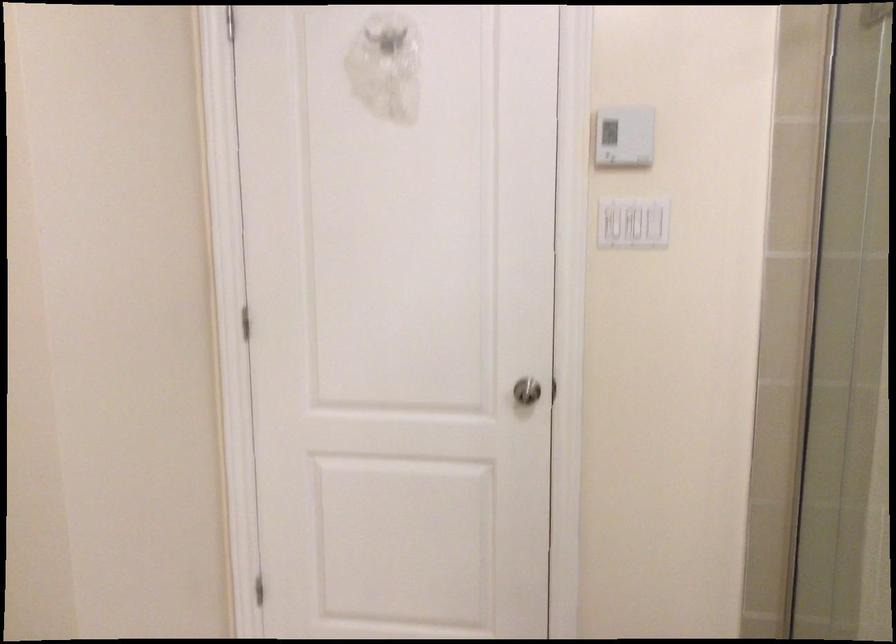
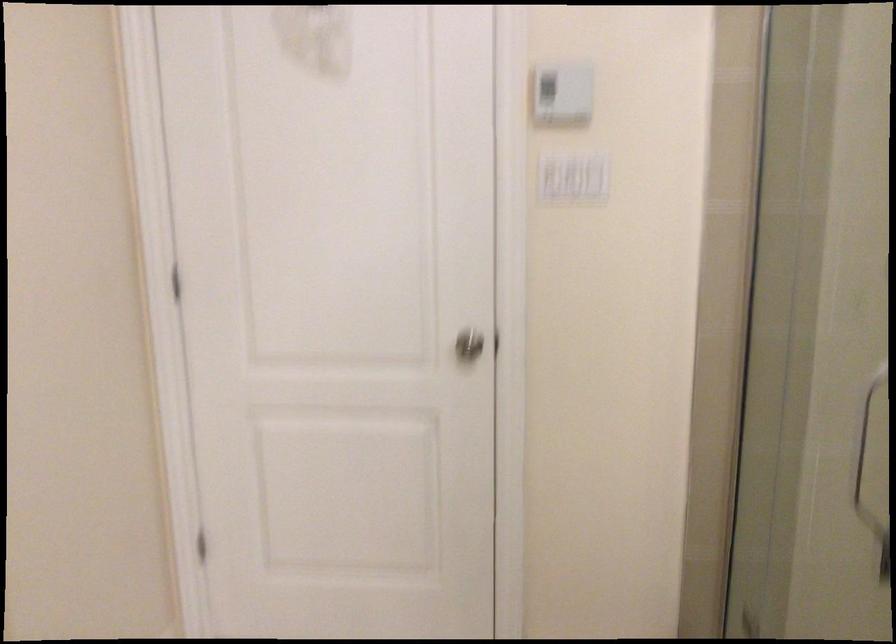
Question: The images are taken continuously from a first-person perspective. In which direction are you moving?

Choices:
 (A) Left
 (B) Right
 (C) Forward
 (D) Backward

Answer: (C)